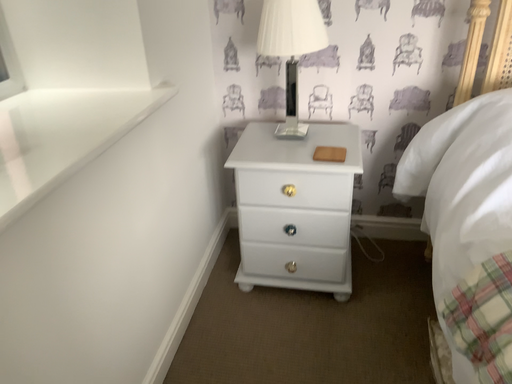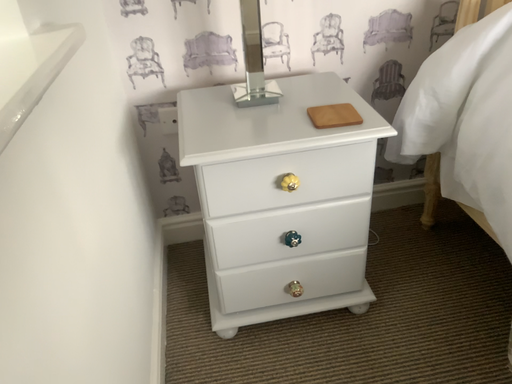
Question: Which way did the camera rotate in the video?

Choices:
 (A) rotated right
 (B) rotated left

Answer: (A)